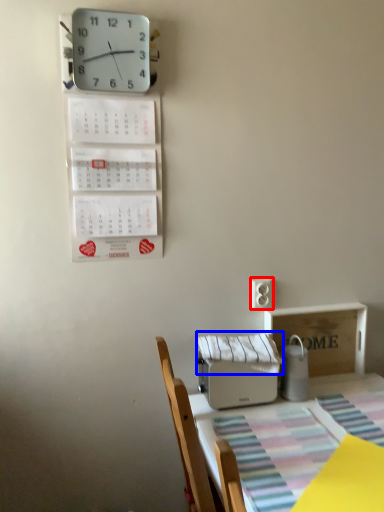
Question: Which of the following is the closest to the observer, electric outlet (highlighted by a red box) or blanket (highlighted by a blue box)?

Choices:
 (A) electric outlet
 (B) blanket

Answer: (B)